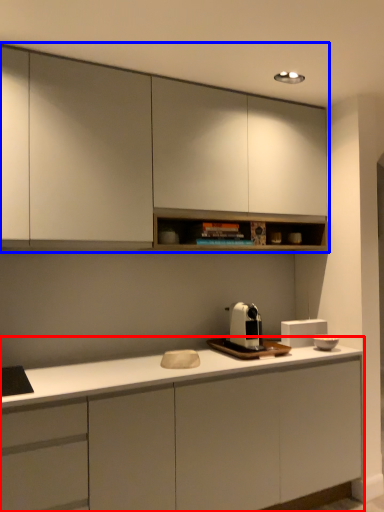
Question: Among these objects, which one is farthest to the camera, cabinetry (highlighted by a red box) or cabinetry (highlighted by a blue box)?

Choices:
 (A) cabinetry
 (B) cabinetry

Answer: (B)